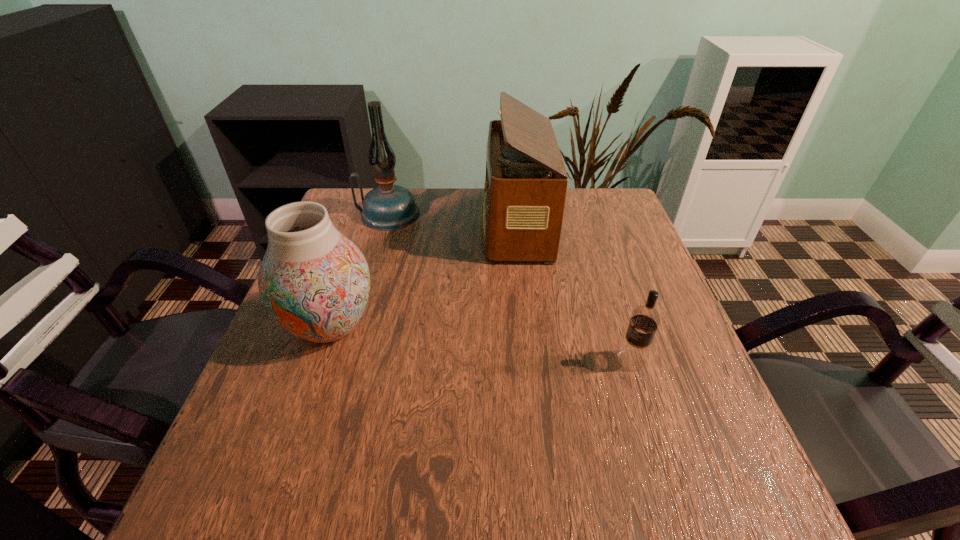
The height and width of the screenshot is (540, 960). What are the coordinates of `vacant region located on the label of the vodka` in the screenshot? It's located at (486, 360).

Locate an element on the screen. This screenshot has height=540, width=960. free space located 0.260m on the label of the vodka is located at coordinates (486, 360).

Locate an element on the screen. This screenshot has width=960, height=540. vacant space located on the label of the vodka is located at coordinates (466, 360).

What are the coordinates of `radio receiver that is positioned at the far edge` in the screenshot? It's located at (525, 187).

Identify the location of oil lamp located at the far edge. Image resolution: width=960 pixels, height=540 pixels. (388, 207).

The image size is (960, 540). I want to click on oil lamp present at the left edge, so click(388, 207).

In order to click on vase located at the left edge in this screenshot , I will do `click(314, 281)`.

Find the location of a particular element. object positioned at the right edge is located at coordinates (633, 354).

The height and width of the screenshot is (540, 960). What are the coordinates of `object situated at the far left corner` in the screenshot? It's located at (388, 207).

Where is `vacant space at the far edge of the desktop`? The width and height of the screenshot is (960, 540). vacant space at the far edge of the desktop is located at coordinates (576, 228).